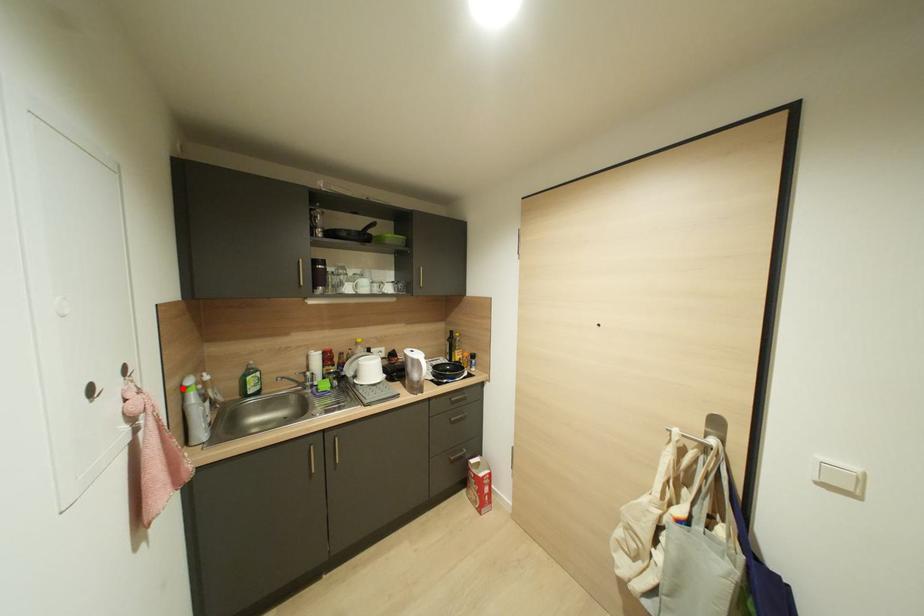
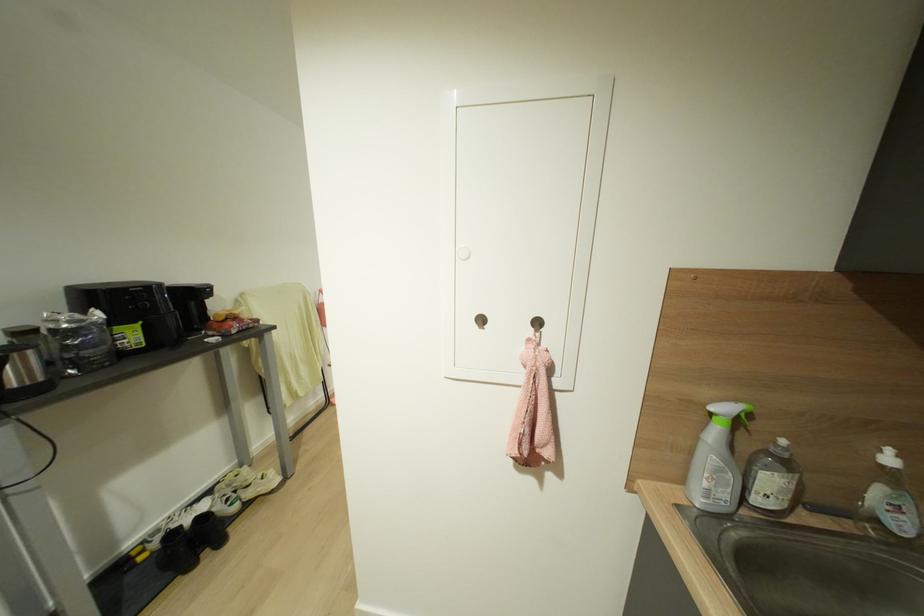
Where in the second image is the point corresponding to the highlighted location from the first image?

(711, 411)